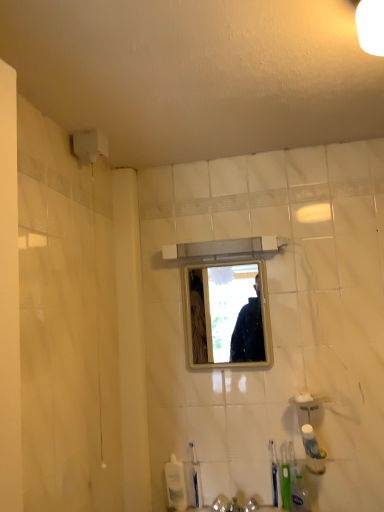
Describe the element at coordinates (175, 484) in the screenshot. I see `clear plastic bottle at lower center, arranged as the 1th toiletry when viewed from the back` at that location.

What is the approximate width of clear glass mirror at center?

The width of clear glass mirror at center is 0.87 inches.

Identify the location of green plastic toothbrush at lower right, which is the 1th toothbrush from right to left. The image size is (384, 512). (293, 476).

Where is `green plastic toothbrush at lower right, which is the 2th toothbrush in right-to-left order`? The image size is (384, 512). green plastic toothbrush at lower right, which is the 2th toothbrush in right-to-left order is located at coordinates pyautogui.click(x=274, y=475).

Is point (193, 475) positioned before point (290, 461)?

No, it is not.

How much distance is there between blue plastic toothbrush at lower center, which appears as the 3th toothbrush when viewed from the right, and green plastic toothbrush at lower right, which ranks as the third toothbrush in left-to-right order?

blue plastic toothbrush at lower center, which appears as the 3th toothbrush when viewed from the right, and green plastic toothbrush at lower right, which ranks as the third toothbrush in left-to-right order, are 13.60 inches apart from each other.

What's the angular difference between blue plastic toothbrush at lower center, which is counted as the 1th toothbrush, starting from the left, and green plastic toothbrush at lower right, which is the 1th toothbrush from right to left,'s facing directions?

The angle between the facing direction of blue plastic toothbrush at lower center, which is counted as the 1th toothbrush, starting from the left, and the facing direction of green plastic toothbrush at lower right, which is the 1th toothbrush from right to left, is 3.49 degrees.

Does blue plastic toothbrush at lower center, which appears as the 3th toothbrush when viewed from the right, lie behind green plastic toothbrush at lower right, which ranks as the third toothbrush in left-to-right order?

Yes, it is behind green plastic toothbrush at lower right, which ranks as the third toothbrush in left-to-right order.

Does green plastic toothbrush at lower right, which is the 2th toothbrush in right-to-left order, have a greater width compared to white plastic toothpaste tube at lower right, the first toiletry viewed from the top?

Incorrect, the width of green plastic toothbrush at lower right, which is the 2th toothbrush in right-to-left order, does not surpass that of white plastic toothpaste tube at lower right, the first toiletry viewed from the top.

Considering the positions of objects green plastic toothbrush at lower right, which ranks as the second toothbrush in left-to-right order, and white plastic toothpaste tube at lower right, which appears as the 2th toiletry when ordered from the bottom, in the image provided, who is in front, green plastic toothbrush at lower right, which ranks as the second toothbrush in left-to-right order, or white plastic toothpaste tube at lower right, which appears as the 2th toiletry when ordered from the bottom,?

white plastic toothpaste tube at lower right, which appears as the 2th toiletry when ordered from the bottom, is closer to the camera.

How different are the orientations of green plastic toothbrush at lower right, which is the 2th toothbrush in right-to-left order, and white plastic toothpaste tube at lower right, the first toiletry viewed from the top, in degrees?

The angle between the facing direction of green plastic toothbrush at lower right, which is the 2th toothbrush in right-to-left order, and the facing direction of white plastic toothpaste tube at lower right, the first toiletry viewed from the top, is 2.9 degrees.

Considering the sizes of green plastic toothbrush at lower right, which is the 2th toothbrush in right-to-left order, and white plastic toothpaste tube at lower right, which is the first toiletry from right to left, in the image, is green plastic toothbrush at lower right, which is the 2th toothbrush in right-to-left order, taller or shorter than white plastic toothpaste tube at lower right, which is the first toiletry from right to left,?

Considering their sizes, green plastic toothbrush at lower right, which is the 2th toothbrush in right-to-left order, has more height than white plastic toothpaste tube at lower right, which is the first toiletry from right to left.

Based on the photo, is white plastic toothpaste tube at lower right, positioned as the 2th toiletry in left-to-right order, positioned with its back to blue plastic toothbrush at lower center, which is counted as the 1th toothbrush, starting from the left?

No, white plastic toothpaste tube at lower right, positioned as the 2th toiletry in left-to-right order, is not facing the opposite direction of blue plastic toothbrush at lower center, which is counted as the 1th toothbrush, starting from the left.

Which object is closer to the camera, white plastic toothpaste tube at lower right, the first toiletry viewed from the top, or blue plastic toothbrush at lower center, which appears as the 3th toothbrush when viewed from the right?

white plastic toothpaste tube at lower right, the first toiletry viewed from the top.

The width and height of the screenshot is (384, 512). Find the location of `toiletry in front of the blue plastic toothbrush at lower center, which is counted as the 1th toothbrush, starting from the left`. toiletry in front of the blue plastic toothbrush at lower center, which is counted as the 1th toothbrush, starting from the left is located at coordinates (312, 450).

From a real-world perspective, is blue plastic toothbrush at lower center, which appears as the 3th toothbrush when viewed from the right, physically above clear plastic bottle at lower center, which is counted as the 2th toiletry, starting from the front?

Yes, from a real-world perspective, blue plastic toothbrush at lower center, which appears as the 3th toothbrush when viewed from the right, is above clear plastic bottle at lower center, which is counted as the 2th toiletry, starting from the front.

From the image's perspective, is blue plastic toothbrush at lower center, which appears as the 3th toothbrush when viewed from the right, over clear plastic bottle at lower center, the first toiletry from the bottom?

Yes, from the image's perspective, blue plastic toothbrush at lower center, which appears as the 3th toothbrush when viewed from the right, is on top of clear plastic bottle at lower center, the first toiletry from the bottom.

Which is more to the right, blue plastic toothbrush at lower center, which appears as the 3th toothbrush when viewed from the right, or clear plastic bottle at lower center, the first toiletry when ordered from left to right?

blue plastic toothbrush at lower center, which appears as the 3th toothbrush when viewed from the right.

Is the surface of green plastic toothbrush at lower right, which is the 1th toothbrush from right to left, in direct contact with clear glass mirror at center?

No, green plastic toothbrush at lower right, which is the 1th toothbrush from right to left, is not touching clear glass mirror at center.

Is green plastic toothbrush at lower right, which is the 1th toothbrush from right to left, not inside clear glass mirror at center?

That's correct, green plastic toothbrush at lower right, which is the 1th toothbrush from right to left, is outside of clear glass mirror at center.

Which object is wider, green plastic toothbrush at lower right, which is the 1th toothbrush from right to left, or clear glass mirror at center?

green plastic toothbrush at lower right, which is the 1th toothbrush from right to left.

Is green plastic toothbrush at lower right, which ranks as the third toothbrush in left-to-right order, looking in the opposite direction of clear glass mirror at center?

No, green plastic toothbrush at lower right, which ranks as the third toothbrush in left-to-right order, is not facing away from clear glass mirror at center.

Is green plastic toothbrush at lower right, which ranks as the third toothbrush in left-to-right order, touching clear plastic bottle at lower center, which is the 2th toiletry in top-to-bottom order?

No, green plastic toothbrush at lower right, which ranks as the third toothbrush in left-to-right order, is not in contact with clear plastic bottle at lower center, which is the 2th toiletry in top-to-bottom order.

In terms of size, does green plastic toothbrush at lower right, which is the 1th toothbrush from right to left, appear bigger or smaller than clear plastic bottle at lower center, the first toiletry when ordered from left to right?

Considering their sizes, green plastic toothbrush at lower right, which is the 1th toothbrush from right to left, takes up less space than clear plastic bottle at lower center, the first toiletry when ordered from left to right.

From the image's perspective, which is above, green plastic toothbrush at lower right, which ranks as the third toothbrush in left-to-right order, or clear plastic bottle at lower center, the first toiletry from the bottom?

From the image's view, green plastic toothbrush at lower right, which ranks as the third toothbrush in left-to-right order, is above.

In the scene shown: Which is more distant, (291, 474) or (178, 486)?

The point (178, 486) is farther from the camera.

From the image's perspective, which is below, green plastic toothbrush at lower right, which ranks as the second toothbrush in left-to-right order, or green plastic toothbrush at lower right, which ranks as the third toothbrush in left-to-right order?

green plastic toothbrush at lower right, which ranks as the second toothbrush in left-to-right order, from the image's perspective.

Can green plastic toothbrush at lower right, which ranks as the third toothbrush in left-to-right order, be found inside green plastic toothbrush at lower right, which ranks as the second toothbrush in left-to-right order?

No, green plastic toothbrush at lower right, which ranks as the third toothbrush in left-to-right order, is not a part of green plastic toothbrush at lower right, which ranks as the second toothbrush in left-to-right order.

From a real-world perspective, is green plastic toothbrush at lower right, which ranks as the second toothbrush in left-to-right order, physically above green plastic toothbrush at lower right, which is the 1th toothbrush from right to left?

No, from a real-world perspective, green plastic toothbrush at lower right, which ranks as the second toothbrush in left-to-right order, is not above green plastic toothbrush at lower right, which is the 1th toothbrush from right to left.

Is green plastic toothbrush at lower right, which ranks as the second toothbrush in left-to-right order, oriented towards green plastic toothbrush at lower right, which ranks as the third toothbrush in left-to-right order?

No, green plastic toothbrush at lower right, which ranks as the second toothbrush in left-to-right order, does not turn towards green plastic toothbrush at lower right, which ranks as the third toothbrush in left-to-right order.

You are a GUI agent. You are given a task and a screenshot of the screen. Output one action in this format:
    pyautogui.click(x=<x>, y=<y>)
    Task: Click on the 2nd toothbrush directly above the blue plastic toothbrush at lower center, which appears as the 3th toothbrush when viewed from the right (from a real-world perspective)
    The width and height of the screenshot is (384, 512).
    Given the screenshot: What is the action you would take?
    pyautogui.click(x=293, y=476)

You are a GUI agent. You are given a task and a screenshot of the screen. Output one action in this format:
    pyautogui.click(x=<x>, y=<y>)
    Task: Click on the toiletry that appears above the green plastic toothbrush at lower right, which ranks as the second toothbrush in left-to-right order (from the image's perspective)
    The width and height of the screenshot is (384, 512).
    Given the screenshot: What is the action you would take?
    pyautogui.click(x=312, y=450)

From the image, which object appears to be farther from white plastic toothpaste tube at lower right, which appears as the 2th toiletry when ordered from the bottom, blue plastic toothbrush at lower center, which appears as the 3th toothbrush when viewed from the right, or clear plastic bottle at lower center, arranged as the 1th toiletry when viewed from the back?

Result: clear plastic bottle at lower center, arranged as the 1th toiletry when viewed from the back, is positioned further to the anchor white plastic toothpaste tube at lower right, which appears as the 2th toiletry when ordered from the bottom.

From the image, which object appears to be nearer to green plastic toothbrush at lower right, which is the 2th toothbrush in right-to-left order, green plastic toothbrush at lower right, which ranks as the third toothbrush in left-to-right order, or blue plastic toothbrush at lower center, which is counted as the 1th toothbrush, starting from the left?

Among the two, green plastic toothbrush at lower right, which ranks as the third toothbrush in left-to-right order, is located nearer to green plastic toothbrush at lower right, which is the 2th toothbrush in right-to-left order.

When comparing their distances from white plastic toothpaste tube at lower right, which appears as the 2th toiletry when ordered from the bottom, does clear glass mirror at center or green plastic toothbrush at lower right, which is the 2th toothbrush in right-to-left order, seem further?

clear glass mirror at center is further to white plastic toothpaste tube at lower right, which appears as the 2th toiletry when ordered from the bottom.

Considering their positions, is blue plastic toothbrush at lower center, which appears as the 3th toothbrush when viewed from the right, positioned further to clear glass mirror at center than green plastic toothbrush at lower right, which is the 2th toothbrush in right-to-left order?

The object further to clear glass mirror at center is blue plastic toothbrush at lower center, which appears as the 3th toothbrush when viewed from the right.

From the image, which object appears to be nearer to clear plastic bottle at lower center, the first toiletry when ordered from left to right, white plastic toothpaste tube at lower right, which appears as the 2th toiletry when ordered from the bottom, or clear glass mirror at center?

Based on the image, white plastic toothpaste tube at lower right, which appears as the 2th toiletry when ordered from the bottom, appears to be nearer to clear plastic bottle at lower center, the first toiletry when ordered from left to right.

Which object lies further to the anchor point white plastic toothpaste tube at lower right, the first toiletry viewed from the top, blue plastic toothbrush at lower center, which appears as the 3th toothbrush when viewed from the right, or clear glass mirror at center?

clear glass mirror at center is positioned further to the anchor white plastic toothpaste tube at lower right, the first toiletry viewed from the top.

Which object lies nearer to the anchor point clear plastic bottle at lower center, which is counted as the 2th toiletry, starting from the front, green plastic toothbrush at lower right, which ranks as the second toothbrush in left-to-right order, or clear glass mirror at center?

green plastic toothbrush at lower right, which ranks as the second toothbrush in left-to-right order, is positioned closer to the anchor clear plastic bottle at lower center, which is counted as the 2th toiletry, starting from the front.

Which object lies nearer to the anchor point clear glass mirror at center, clear plastic bottle at lower center, the first toiletry when ordered from left to right, or green plastic toothbrush at lower right, which is the 2th toothbrush in right-to-left order?

green plastic toothbrush at lower right, which is the 2th toothbrush in right-to-left order, lies closer to clear glass mirror at center than the other object.

Locate an element on the screen. toothbrush between clear glass mirror at center and green plastic toothbrush at lower right, which is the 2th toothbrush in right-to-left order, from top to bottom is located at coordinates (293, 476).

Identify the location of toiletry between clear glass mirror at center and clear plastic bottle at lower center, arranged as the 1th toiletry when viewed from the back, in the up-down direction. The height and width of the screenshot is (512, 384). (312, 450).

Where is `toothbrush between green plastic toothbrush at lower right, which is the 2th toothbrush in right-to-left order, and white plastic toothpaste tube at lower right, which is the first toiletry from front to back`? The width and height of the screenshot is (384, 512). toothbrush between green plastic toothbrush at lower right, which is the 2th toothbrush in right-to-left order, and white plastic toothpaste tube at lower right, which is the first toiletry from front to back is located at coordinates (293, 476).

At what (x,y) coordinates should I click in order to perform the action: click on toothbrush between clear plastic bottle at lower center, which is counted as the 2th toiletry, starting from the front, and green plastic toothbrush at lower right, which ranks as the second toothbrush in left-to-right order, from left to right. Please return your answer as a coordinate pair (x, y). This screenshot has width=384, height=512. Looking at the image, I should click on (195, 477).